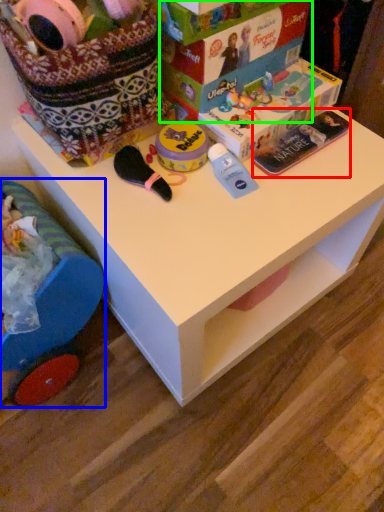
Question: Which object is positioned closest to magazine (highlighted by a red box)? Select from toy (highlighted by a blue box) and storage box (highlighted by a green box).

Choices:
 (A) toy
 (B) storage box

Answer: (B)